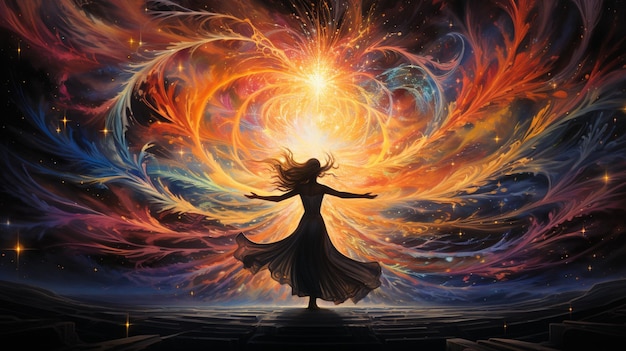
The image size is (626, 351). In order to click on floor in this screenshot , I will do `click(382, 327)`.